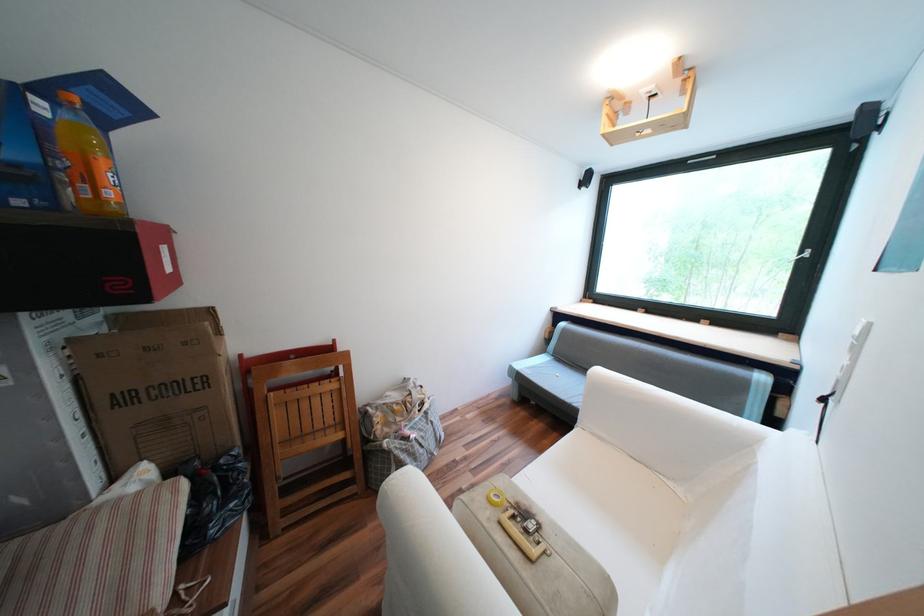
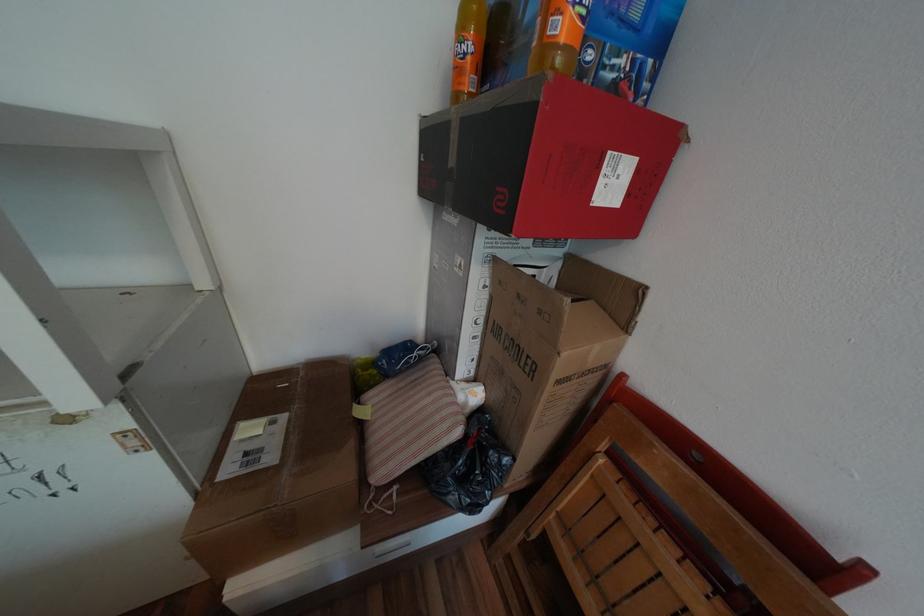
Find the pixel in the second image that matches point 118,193 in the first image.

(569, 26)